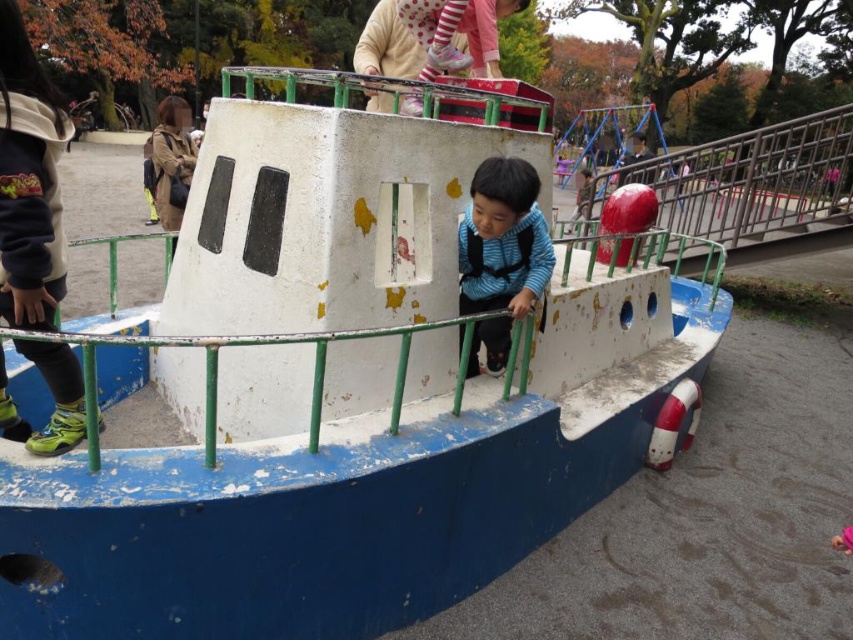
Is the position of metallic green railing at upper right more distant than that of blue matte vest at center?

Yes, metallic green railing at upper right is behind blue matte vest at center.

Can you confirm if metallic green railing at upper right is positioned to the left of blue matte vest at center?

Incorrect, metallic green railing at upper right is not on the left side of blue matte vest at center.

Is point (846, 116) positioned in front of point (492, 330)?

No, it is behind (492, 330).

Locate an element on the screen. The image size is (853, 640). metallic green railing at upper right is located at coordinates (750, 188).

Is point (796, 236) more distant than point (653, 461)?

Yes, point (796, 236) is farther from viewer.

Can you confirm if metallic green railing at upper right is taller than white rubber lifebuoy at lower right?

Yes.

Locate an element on the screen. metallic green railing at upper right is located at coordinates (750, 188).

Does blue matte vest at center appear on the right side of white rubber lifebuoy at lower right?

In fact, blue matte vest at center is to the left of white rubber lifebuoy at lower right.

Which is in front, point (506, 284) or point (676, 397)?

Positioned in front is point (506, 284).

Find the location of a particular element. Image resolution: width=853 pixels, height=640 pixels. blue matte vest at center is located at coordinates click(502, 253).

Where is `blue matte vest at center`? This screenshot has width=853, height=640. blue matte vest at center is located at coordinates [502, 253].